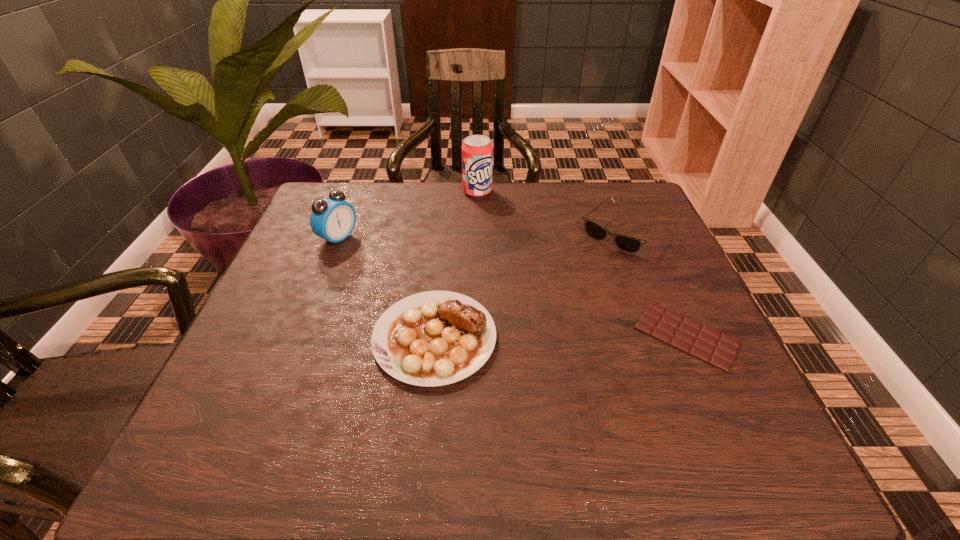
Locate an element on the screen. The height and width of the screenshot is (540, 960). steak is located at coordinates (434, 338).

Image resolution: width=960 pixels, height=540 pixels. I want to click on the shortest object, so click(x=718, y=349).

At what (x,y) coordinates should I click in order to perform the action: click on alarm clock. Please return your answer as a coordinate pair (x, y). The width and height of the screenshot is (960, 540). Looking at the image, I should click on pyautogui.click(x=333, y=219).

Locate an element on the screen. The width and height of the screenshot is (960, 540). the second tallest object is located at coordinates (333, 219).

At what (x,y) coordinates should I click in order to perform the action: click on the farthest object. Please return your answer as a coordinate pair (x, y). Looking at the image, I should click on (477, 152).

Find the location of a particular element. the tallest object is located at coordinates (477, 152).

Image resolution: width=960 pixels, height=540 pixels. I want to click on sunglasses, so click(x=629, y=244).

At what (x,y) coordinates should I click in order to perform the action: click on vacant area located on the right of the steak. Please return your answer as a coordinate pair (x, y). Looking at the image, I should click on 690,338.

You are a GUI agent. You are given a task and a screenshot of the screen. Output one action in this format:
    pyautogui.click(x=<x>, y=<y>)
    Task: Click on the free region located 0.140m on the left of the shortest object
    This screenshot has height=540, width=960.
    Given the screenshot: What is the action you would take?
    pyautogui.click(x=564, y=335)

You are a GUI agent. You are given a task and a screenshot of the screen. Output one action in this format:
    pyautogui.click(x=<x>, y=<y>)
    Task: Click on the vacant space situated 0.180m on the face of the alarm clock
    
    Given the screenshot: What is the action you would take?
    pyautogui.click(x=408, y=271)